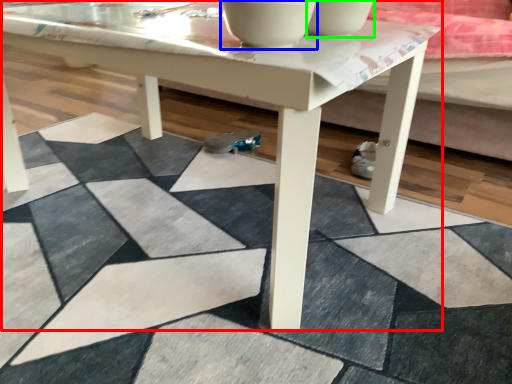
Question: Which object is positioned farthest from coffee table (highlighted by a red box)? Select from bowl (highlighted by a blue box) and bowl (highlighted by a green box).

Choices:
 (A) bowl
 (B) bowl

Answer: (B)